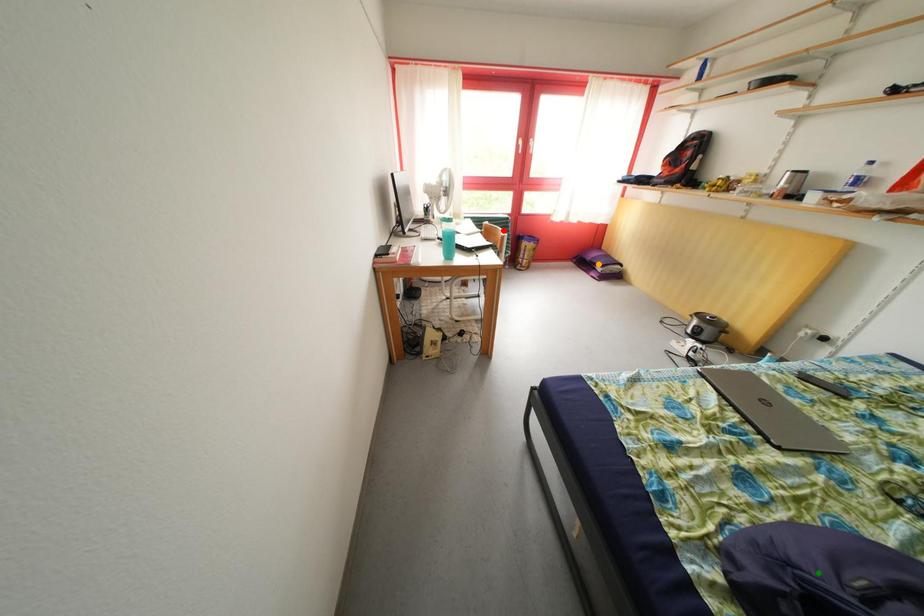
Order these from nearest to farthest:
orange point
green point
red point

orange point < red point < green point